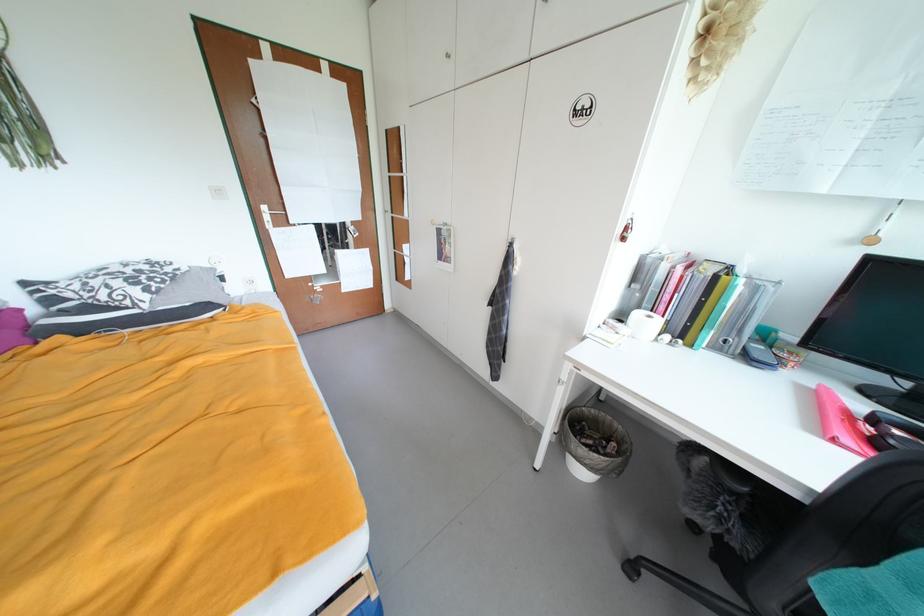
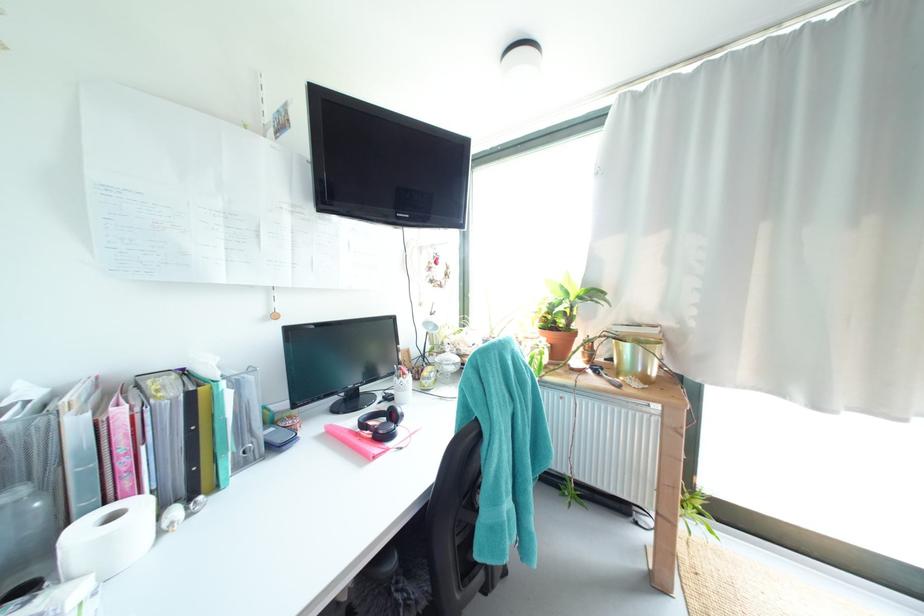
Find the pixel in the second image that matches pixel 675 339 in the first image.

(185, 513)